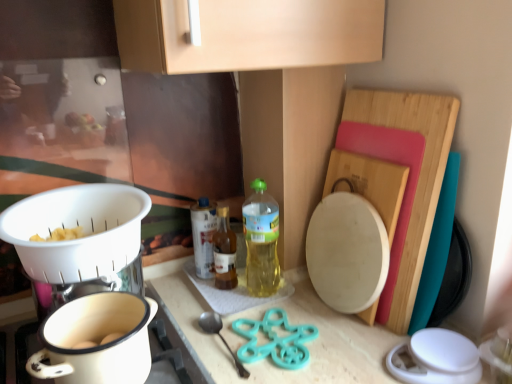
Question: Is translucent plastic bottle at center, which ranks as the 3th bottle in left-to-right order, bigger or smaller than wooden cutting board at right?

Choices:
 (A) small
 (B) big

Answer: (A)

Question: From their relative heights in the image, would you say translucent plastic bottle at center, which is the 1th bottle from right to left, is taller or shorter than wooden cutting board at right?

Choices:
 (A) short
 (B) tall

Answer: (A)

Question: Estimate the real-world distances between objects in this image. Which object is farther from the white plastic colander at left?

Choices:
 (A) translucent plastic bottle at center, positioned as the 1th bottle in left-to-right order
 (B) white ceramic pot at lower left
 (C) wooden cutting board at right
 (D) translucent glass bottle at center, acting as the 2th bottle starting from the right
 (E) translucent plastic bottle at center, which ranks as the 3th bottle in left-to-right order

Answer: (C)

Question: Which object is the farthest from the white plastic colander at left?

Choices:
 (A) translucent plastic bottle at center, which is the 1th bottle from right to left
 (B) translucent glass bottle at center, marked as the second bottle in a left-to-right arrangement
 (C) white ceramic pot at lower left
 (D) teal plastic spoon at lower center
 (E) wooden cutting board at right

Answer: (E)